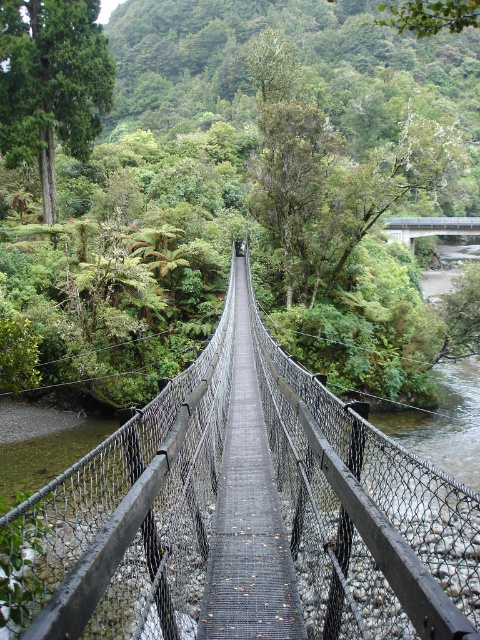
You are a hiker who wants to cross the river using the bridge. You notice two bridges in the image, the wooden mesh bridge at center and the metallic gray bridge at center. Which bridge is farther away from the other?

The wooden mesh bridge at center is 57.61 meters from metallic gray bridge at center, so the wooden mesh bridge at center is farther away from the metallic gray bridge at center.

You are a photographer holding a camera that is 0.5 meters wide. You are standing on the wooden mesh bridge at center and want to capture a wide shot of the bridge and the surrounding greenery. Can you move your camera sideways along the bridge without hitting the railing? Please explain your reasoning.

The wooden mesh bridge at center and the camera are 1.30 meters apart. Since the camera is 0.5 meters wide, there is sufficient space between the bridge and the camera to move sideways without hitting the railing.